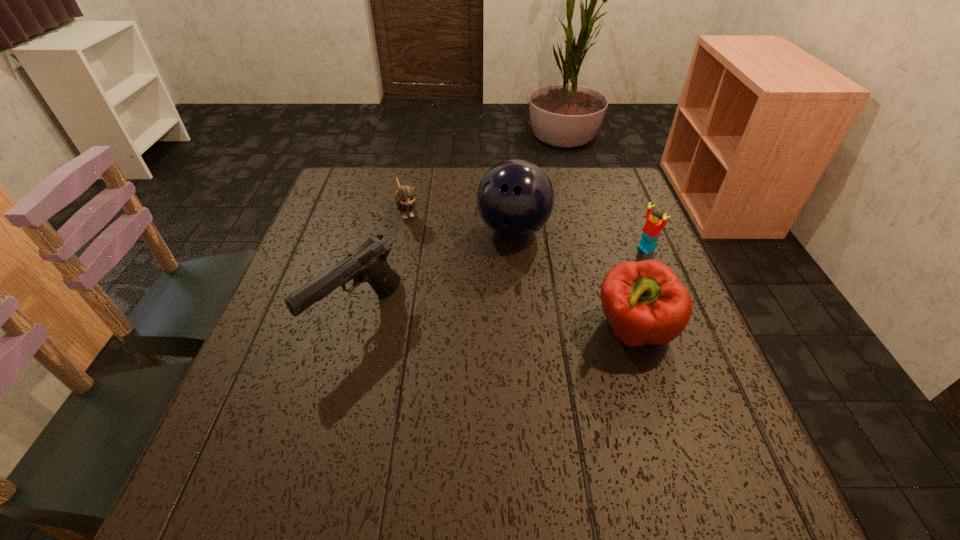
You are a GUI agent. You are given a task and a screenshot of the screen. Output one action in this format:
    pyautogui.click(x=<x>, y=<y>)
    Task: Click on the gun
    The image size is (960, 540).
    Given the screenshot: What is the action you would take?
    pyautogui.click(x=367, y=263)

This screenshot has width=960, height=540. Identify the location of bell pepper. click(646, 303).

Where is `Lego`? The image size is (960, 540). Lego is located at coordinates (653, 226).

Locate an element on the screen. The width and height of the screenshot is (960, 540). kitten is located at coordinates (405, 200).

Locate an element on the screen. The height and width of the screenshot is (540, 960). bowling ball is located at coordinates coord(515,198).

Locate an element on the screen. blank space located at the muzzle of the gun is located at coordinates (327, 430).

Where is `vacant area situated 0.080m on the front of the bell pepper`? vacant area situated 0.080m on the front of the bell pepper is located at coordinates coord(656,400).

I want to click on vacant region located 0.250m on the face of the Lego, so click(x=556, y=286).

At what (x,y) coordinates should I click in order to perform the action: click on vacant space located 0.370m on the face of the Lego. Please return your answer as a coordinate pair (x, y). This screenshot has width=960, height=540. Looking at the image, I should click on (511, 303).

In order to click on vacant space located on the face of the Lego in this screenshot , I will do `click(545, 290)`.